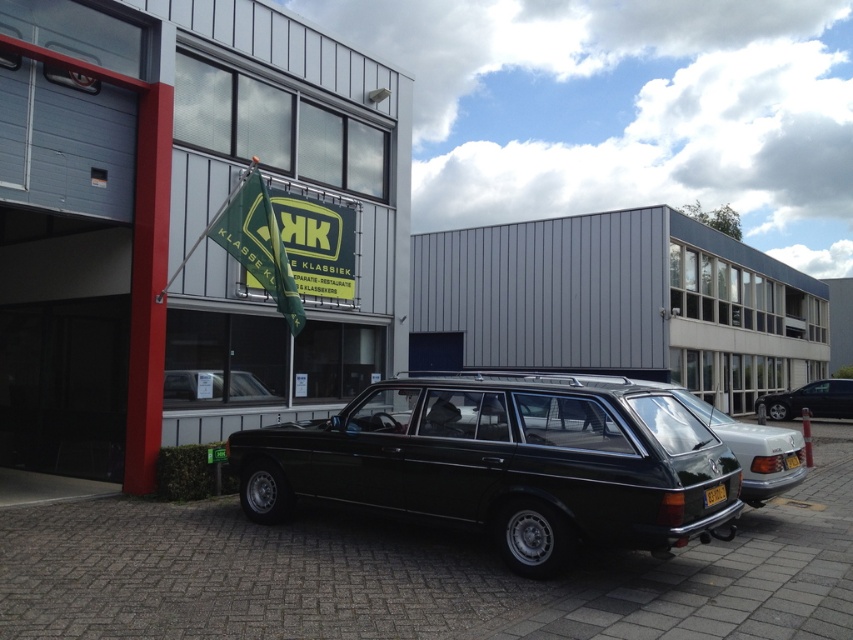
Is yellow matte license plate at rear behind yellow plastic license plate at center?

That is False.

The width and height of the screenshot is (853, 640). I want to click on yellow matte license plate at rear, so click(714, 493).

Between black metallic station wagon at center and shiny black station wagon at right, which one is positioned lower?

shiny black station wagon at right

What do you see at coordinates (505, 461) in the screenshot?
I see `black metallic station wagon at center` at bounding box center [505, 461].

Is point (566, 435) less distant than point (766, 406)?

Yes, point (566, 435) is in front of point (766, 406).

Where is `black metallic station wagon at center`? black metallic station wagon at center is located at coordinates (505, 461).

Can you confirm if shiny black station wagon at right is smaller than yellow matte license plate at rear?

No.

Is shiny black station wagon at right thinner than yellow matte license plate at rear?

Incorrect, shiny black station wagon at right's width is not less than yellow matte license plate at rear's.

Who is more forward, (844, 397) or (718, 492)?

Point (718, 492) is more forward.

Locate an element on the screen. Image resolution: width=853 pixels, height=640 pixels. shiny black station wagon at right is located at coordinates (810, 401).